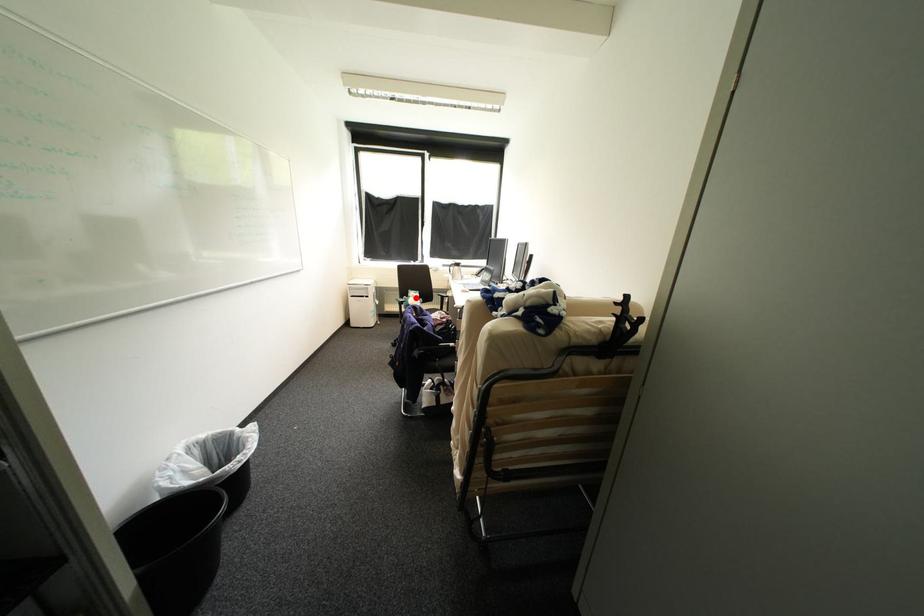
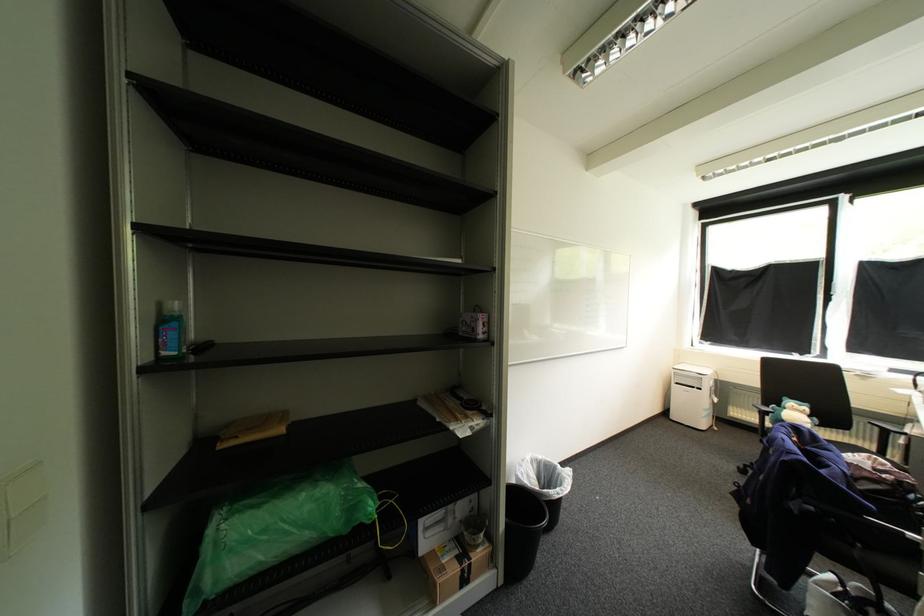
In the second image, find the point that corresponds to the highlighted location in the first image.

(792, 408)